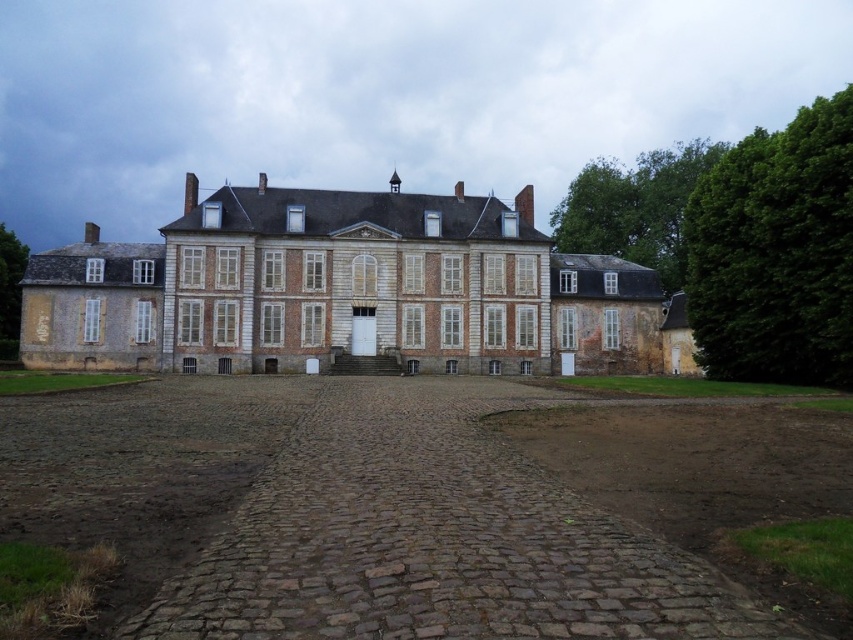
You are planning to drive a large truck to the chateau and need to know if the brown cobblestone driveway at center can accommodate it. Considering the driveway is narrower than the green leafy tree at upper right, can you determine if the driveway is wide enough for the truck?

The brown cobblestone driveway at center occupies less space than the green leafy tree at upper right, so it is likely narrower. If the truck requires more space than the driveway provides, it may not fit. However, without specific measurements, it is difficult to confirm.